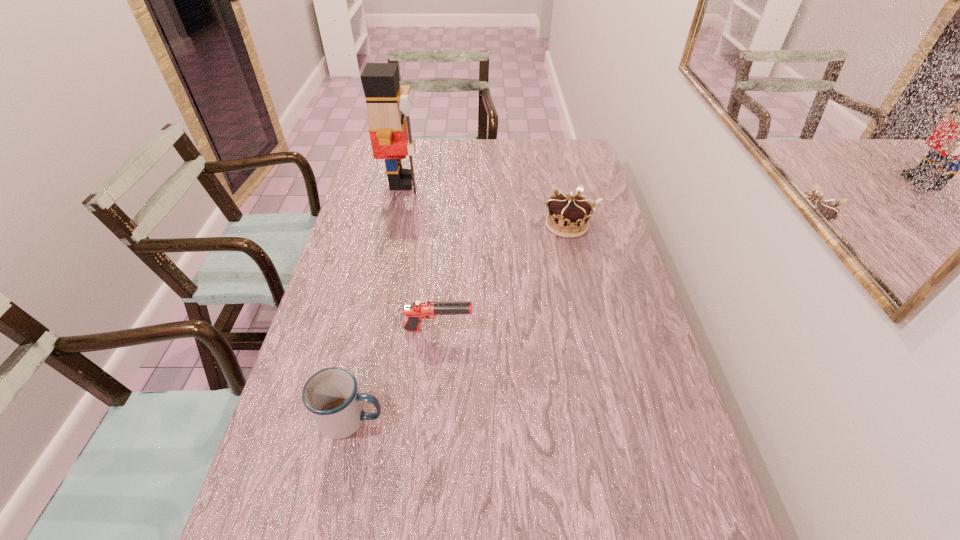
The image size is (960, 540). I want to click on the closest object to the second object from right to left, so click(331, 395).

In order to click on object that stands as the second closest to the crown in this screenshot , I will do `click(388, 105)`.

The width and height of the screenshot is (960, 540). In order to click on free spot that satisfies the following two spatial constraints: 1. on the front side of the crown; 2. at the aiming end of the third farthest object in this screenshot , I will do `click(590, 330)`.

Where is `vacant space that satisfies the following two spatial constraints: 1. in front of the rightmost object holding the staff; 2. on the left side of the tallest object`? This screenshot has height=540, width=960. vacant space that satisfies the following two spatial constraints: 1. in front of the rightmost object holding the staff; 2. on the left side of the tallest object is located at coordinates (393, 225).

Where is `blank space that satisfies the following two spatial constraints: 1. on the back side of the rightmost object; 2. in front of the farthest object holding the staff`? Image resolution: width=960 pixels, height=540 pixels. blank space that satisfies the following two spatial constraints: 1. on the back side of the rightmost object; 2. in front of the farthest object holding the staff is located at coordinates (558, 182).

In order to click on vacant space that satisfies the following two spatial constraints: 1. in front of the second farthest object holding the staff; 2. on the right side of the tallest object in this screenshot , I will do `click(393, 225)`.